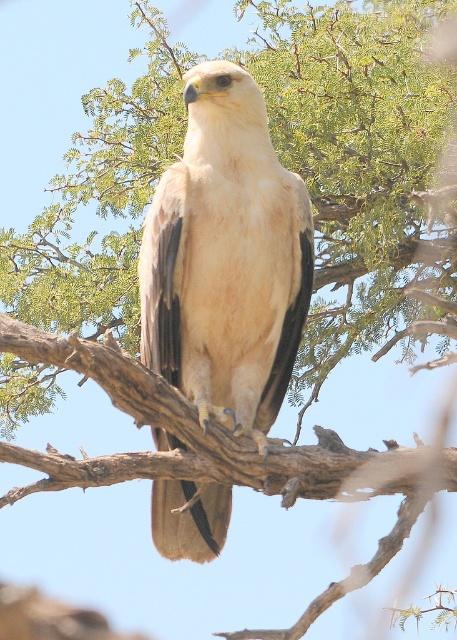
You are a photographer standing in front of the tree where the Tawny Eagle is perched. You notice two points marked in the image at coordinates point (159,332) and point (131,464). Which point is closer to you?

Point (159,332) is closer to you because it is further to the viewer than point (131,464).

You are a wildlife photographer aiming to capture the light brown feathered eagle at center and the brown rough tree branch at center in a single frame. Based on their sizes, which object should you focus on first to ensure both are in focus?

The light brown feathered eagle at center is smaller than the brown rough tree branch at center, so you should focus on the brown rough tree branch at center first to ensure both are in focus since it is larger and occupies more space in the frame.